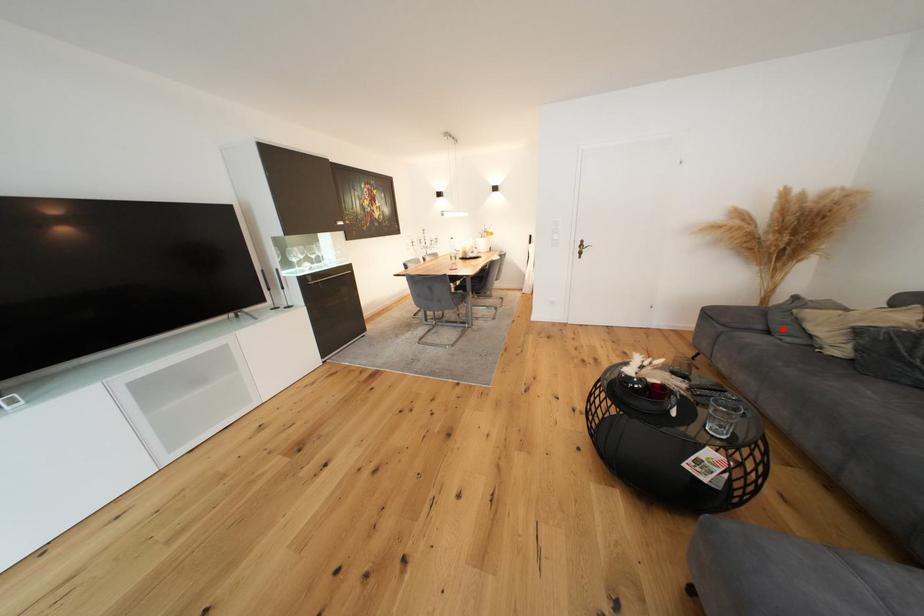
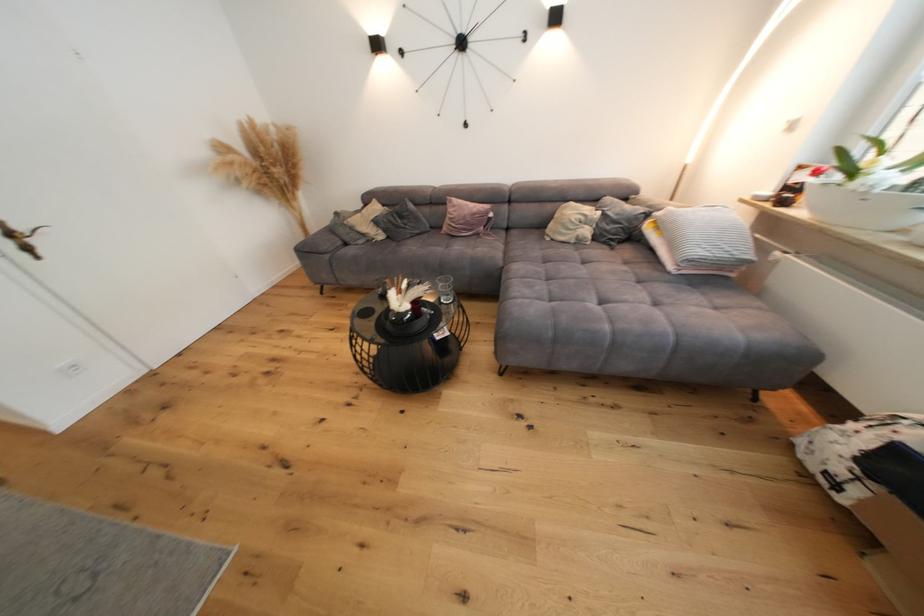
Where in the second image is the point corresponding to the highlighted location from the first image?

(354, 240)